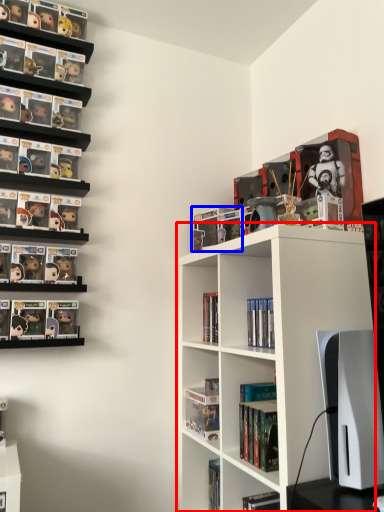
Question: Which object is further to the camera taking this photo, shelf (highlighted by a red box) or book (highlighted by a blue box)?

Choices:
 (A) shelf
 (B) book

Answer: (B)